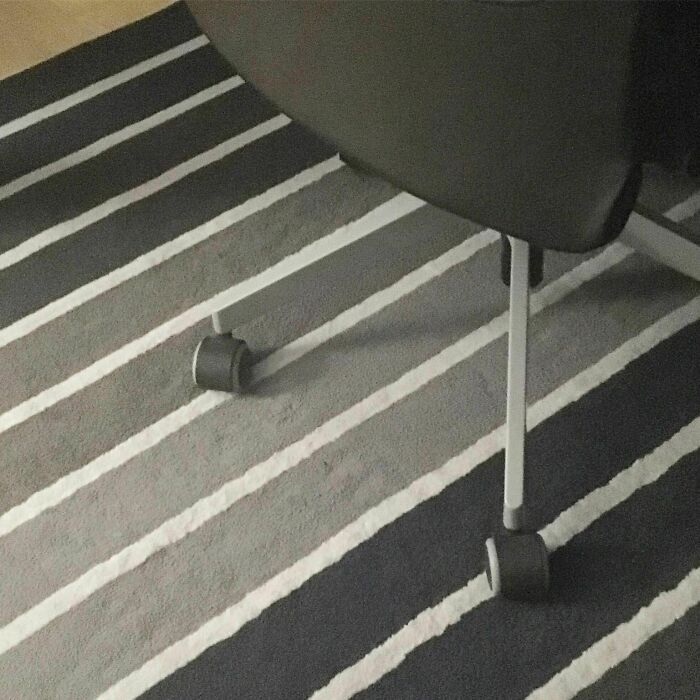
This screenshot has height=700, width=700. I want to click on floor, so click(x=18, y=55), click(x=84, y=24).